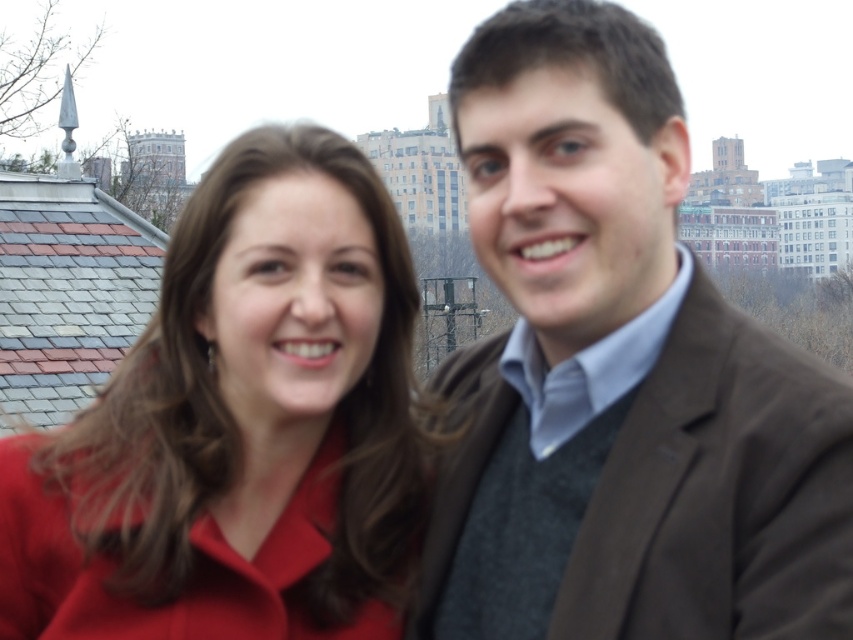
Question: Can you confirm if matte brown jacket at center is wider than matte red coat at center?

Choices:
 (A) no
 (B) yes

Answer: (A)

Question: Which of the following is the farthest from the observer?

Choices:
 (A) (643, 404)
 (B) (314, 188)

Answer: (B)

Question: Can you confirm if matte brown jacket at center is wider than matte red coat at center?

Choices:
 (A) yes
 (B) no

Answer: (B)

Question: Observing the image, what is the correct spatial positioning of matte brown jacket at center in reference to matte red coat at center?

Choices:
 (A) above
 (B) below

Answer: (A)

Question: Among these objects, which one is farthest from the camera?

Choices:
 (A) matte brown jacket at center
 (B) matte red coat at center

Answer: (B)